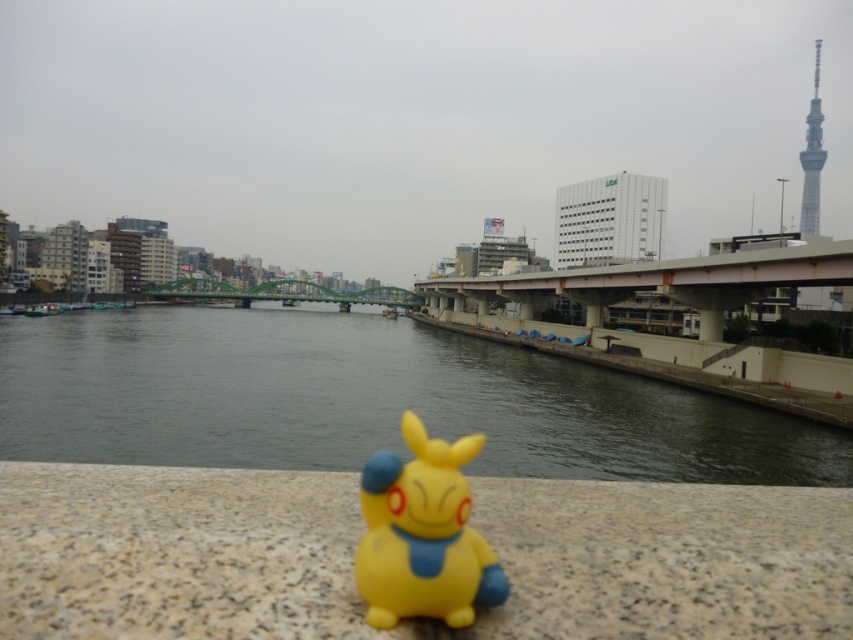
Does smooth concrete river at center appear over yellow matte pikachu at center?

Indeed, smooth concrete river at center is positioned over yellow matte pikachu at center.

Between point (33, 419) and point (434, 512), which one is positioned behind?

The point (33, 419) is more distant.

Does point (558, 397) come behind point (403, 436)?

Yes, it is behind point (403, 436).

Identify the location of smooth concrete river at center. (367, 401).